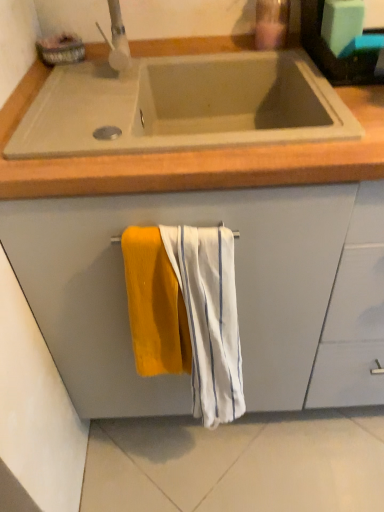
This screenshot has width=384, height=512. What do you see at coordinates (155, 305) in the screenshot?
I see `soft yellow towel at center, positioned as the 1th beach towel in left-to-right order` at bounding box center [155, 305].

What do you see at coordinates (237, 293) in the screenshot? I see `matte gray cabinet at center` at bounding box center [237, 293].

Describe the element at coordinates (209, 318) in the screenshot. I see `white textured towel at center, the second beach towel when ordered from left to right` at that location.

Locate an element on the screen. soft yellow towel at center, positioned as the 1th beach towel in left-to-right order is located at coordinates (155, 305).

Is point (247, 167) closer to camera compared to point (174, 290)?

Yes, point (247, 167) is closer to viewer.

From a real-world perspective, is beige concrete sink at upper center located beneath soft yellow towel at center, which is the second beach towel in right-to-left order?

Incorrect, from a real-world perspective, beige concrete sink at upper center is higher than soft yellow towel at center, which is the second beach towel in right-to-left order.

From the image's perspective, which one is positioned higher, beige concrete sink at upper center or soft yellow towel at center, which is the second beach towel in right-to-left order?

beige concrete sink at upper center, from the image's perspective.

Does beige concrete sink at upper center contain soft yellow towel at center, which is the second beach towel in right-to-left order?

No.

In the image, is translucent plastic soap dispenser at upper center on the left side or the right side of soft yellow towel at center, which is the second beach towel in right-to-left order?

translucent plastic soap dispenser at upper center is positioned on soft yellow towel at center, which is the second beach towel in right-to-left order,'s right side.

Considering the sizes of objects translucent plastic soap dispenser at upper center and soft yellow towel at center, positioned as the 1th beach towel in left-to-right order, in the image provided, who is wider, translucent plastic soap dispenser at upper center or soft yellow towel at center, positioned as the 1th beach towel in left-to-right order,?

Wider between the two is translucent plastic soap dispenser at upper center.

Considering the sizes of objects translucent plastic soap dispenser at upper center and soft yellow towel at center, which is the second beach towel in right-to-left order, in the image provided, who is taller, translucent plastic soap dispenser at upper center or soft yellow towel at center, which is the second beach towel in right-to-left order,?

With more height is soft yellow towel at center, which is the second beach towel in right-to-left order.

Find the location of a particular element. The height and width of the screenshot is (512, 384). soap dispenser to the right of soft yellow towel at center, which is the second beach towel in right-to-left order is located at coordinates (271, 24).

Which object is further away from the camera, matte gray cabinet at center or translucent plastic soap dispenser at upper center?

Positioned behind is translucent plastic soap dispenser at upper center.

Would you say matte gray cabinet at center is to the left or to the right of translucent plastic soap dispenser at upper center in the picture?

matte gray cabinet at center is to the right of translucent plastic soap dispenser at upper center.

Does matte gray cabinet at center have a lesser width compared to translucent plastic soap dispenser at upper center?

In fact, matte gray cabinet at center might be wider than translucent plastic soap dispenser at upper center.

Which is behind, point (128, 223) or point (70, 184)?

The point (128, 223) is more distant.

From the image's perspective, is matte gray cabinet at center beneath beige concrete sink at upper center?

Indeed, from the image's perspective, matte gray cabinet at center is shown beneath beige concrete sink at upper center.

Identify the location of cabinetry below the beige concrete sink at upper center (from the image's perspective). This screenshot has height=512, width=384. (237, 293).

Is matte gray cabinet at center in contact with beige concrete sink at upper center?

No, matte gray cabinet at center is not making contact with beige concrete sink at upper center.

Does point (139, 165) come closer to viewer compared to point (316, 197)?

Yes, point (139, 165) is closer to viewer.

Who is bigger, beige concrete sink at upper center or matte gray cabinet at center?

matte gray cabinet at center is bigger.

In the scene shown: Is beige concrete sink at upper center directly adjacent to matte gray cabinet at center?

No, beige concrete sink at upper center is not with matte gray cabinet at center.

Is beige concrete sink at upper center oriented away from matte gray cabinet at center?

Yes, beige concrete sink at upper center is positioned with its back facing matte gray cabinet at center.

From the image's perspective, is white textured towel at center, the second beach towel when ordered from left to right, above matte gray cabinet at center?

Actually, white textured towel at center, the second beach towel when ordered from left to right, appears below matte gray cabinet at center in the image.

Does white textured towel at center, the second beach towel when ordered from left to right, appear on the right side of matte gray cabinet at center?

Incorrect, white textured towel at center, the second beach towel when ordered from left to right, is not on the right side of matte gray cabinet at center.

Considering the sizes of objects white textured towel at center, the second beach towel when ordered from left to right, and matte gray cabinet at center in the image provided, who is taller, white textured towel at center, the second beach towel when ordered from left to right, or matte gray cabinet at center?

matte gray cabinet at center.

Is white textured towel at center, the second beach towel when ordered from left to right, directly adjacent to translucent plastic soap dispenser at upper center?

No, white textured towel at center, the second beach towel when ordered from left to right, is not touching translucent plastic soap dispenser at upper center.

From the image's perspective, is white textured towel at center, the second beach towel when ordered from left to right, above or below translucent plastic soap dispenser at upper center?

white textured towel at center, the second beach towel when ordered from left to right, is below translucent plastic soap dispenser at upper center.

Can you confirm if white textured towel at center, the second beach towel when ordered from left to right, is bigger than translucent plastic soap dispenser at upper center?

Yes, white textured towel at center, the second beach towel when ordered from left to right, is bigger than translucent plastic soap dispenser at upper center.

The image size is (384, 512). I want to click on countertop that appears above the soft yellow towel at center, positioned as the 1th beach towel in left-to-right order (from a real-world perspective), so click(x=194, y=158).

I want to click on soap dispenser behind the soft yellow towel at center, which is the second beach towel in right-to-left order, so coord(271,24).

Based on their spatial positions, is soft yellow towel at center, positioned as the 1th beach towel in left-to-right order, or translucent plastic soap dispenser at upper center further from beige concrete sink at upper center?

translucent plastic soap dispenser at upper center is further to beige concrete sink at upper center.

When comparing their distances from matte gray cabinet at center, does beige concrete sink at upper center or white textured towel at center, the 1th beach towel in the right-to-left sequence, seem closer?

The object closer to matte gray cabinet at center is white textured towel at center, the 1th beach towel in the right-to-left sequence.

From the image, which object appears to be farther from beige concrete sink at upper center, soft yellow towel at center, positioned as the 1th beach towel in left-to-right order, or matte gray cabinet at center?

matte gray cabinet at center.

When comparing their distances from soft yellow towel at center, which is the second beach towel in right-to-left order, does translucent plastic soap dispenser at upper center or matte gray cabinet at center seem closer?

Among the two, matte gray cabinet at center is located nearer to soft yellow towel at center, which is the second beach towel in right-to-left order.

Based on their spatial positions, is translucent plastic soap dispenser at upper center or beige concrete sink at upper center closer to white textured towel at center, the 1th beach towel in the right-to-left sequence?

beige concrete sink at upper center is positioned closer to the anchor white textured towel at center, the 1th beach towel in the right-to-left sequence.

From the picture: Estimate the real-world distances between objects in this image. Which object is closer to soft yellow towel at center, which is the second beach towel in right-to-left order, matte gray cabinet at center or translucent plastic soap dispenser at upper center?

Among the two, matte gray cabinet at center is located nearer to soft yellow towel at center, which is the second beach towel in right-to-left order.

Estimate the real-world distances between objects in this image. Which object is further from translucent plastic soap dispenser at upper center, beige concrete sink at upper center or white textured towel at center, the second beach towel when ordered from left to right?

Based on the image, white textured towel at center, the second beach towel when ordered from left to right, appears to be further to translucent plastic soap dispenser at upper center.

Looking at the image, which one is located further to matte gray cabinet at center, soft yellow towel at center, positioned as the 1th beach towel in left-to-right order, or white textured towel at center, the second beach towel when ordered from left to right?

soft yellow towel at center, positioned as the 1th beach towel in left-to-right order.

Identify the location of cabinetry between beige concrete sink at upper center and white textured towel at center, the second beach towel when ordered from left to right, vertically. (237, 293).

Locate an element on the screen. The image size is (384, 512). cabinetry between translucent plastic soap dispenser at upper center and soft yellow towel at center, positioned as the 1th beach towel in left-to-right order, in the up-down direction is located at coordinates (237, 293).

Identify the location of countertop between translucent plastic soap dispenser at upper center and matte gray cabinet at center in the up-down direction. Image resolution: width=384 pixels, height=512 pixels. (194, 158).

Find the location of `beach towel between translucent plastic soap dispenser at upper center and white textured towel at center, the 1th beach towel in the right-to-left sequence, in the up-down direction`. beach towel between translucent plastic soap dispenser at upper center and white textured towel at center, the 1th beach towel in the right-to-left sequence, in the up-down direction is located at coordinates (155, 305).